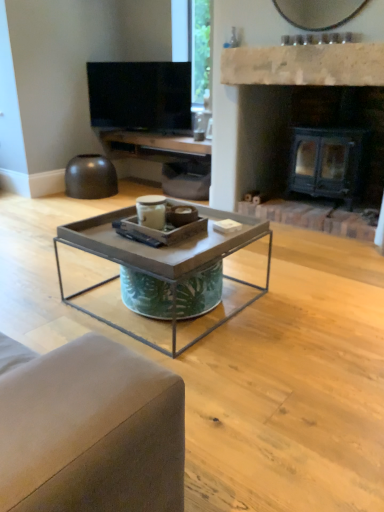
Question: From the image's perspective, is white stone fireplace at upper center positioned above or below flat screen tv at upper center?

Choices:
 (A) above
 (B) below

Answer: (B)

Question: Is white stone fireplace at upper center situated inside flat screen tv at upper center or outside?

Choices:
 (A) outside
 (B) inside

Answer: (A)

Question: Considering the real-world distances, which object is farthest from the matte wood entertainment center at upper center?

Choices:
 (A) white stone fireplace at upper center
 (B) black metal fireplace at center
 (C) metal/texturedcoffee table at center
 (D) flat screen tv at upper center

Answer: (C)

Question: Estimate the real-world distances between objects in this image. Which object is closer to the matte wood entertainment center at upper center?

Choices:
 (A) black metal fireplace at center
 (B) white stone fireplace at upper center
 (C) flat screen tv at upper center
 (D) metal/texturedcoffee table at center

Answer: (C)